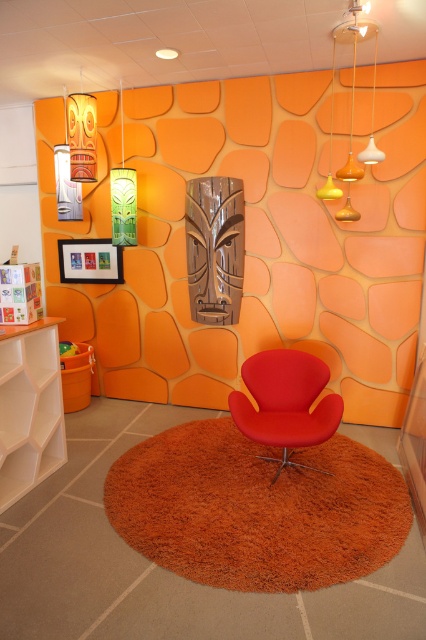
Question: Which of the following is the farthest from the observer?

Choices:
 (A) green fabric lampshade at upper left
 (B) matte orange pendant light at upper right
 (C) metallic silver lampshade at upper left
 (D) white glossy pendant light at upper right

Answer: (C)

Question: Can you confirm if matte orange pendant light at upper right is positioned to the left of white glossy pendant light at upper right?

Choices:
 (A) no
 (B) yes

Answer: (B)

Question: Can you confirm if matte orange pendant light at upper right is positioned below metallic silver lampshade at upper left?

Choices:
 (A) no
 (B) yes

Answer: (B)

Question: Which point is closer to the camera taking this photo?

Choices:
 (A) (63, 106)
 (B) (374, 150)

Answer: (B)

Question: Considering the real-world distances, which object is farthest from the green fabric lampshade at upper left?

Choices:
 (A) matte orange pendant light at upper right
 (B) white glossy pendant light at upper right
 (C) metallic silver lampshade at upper left

Answer: (B)

Question: From the image, what is the correct spatial relationship of matte orange pendant light at upper right in relation to white glossy pendant light at upper right?

Choices:
 (A) right
 (B) left

Answer: (B)